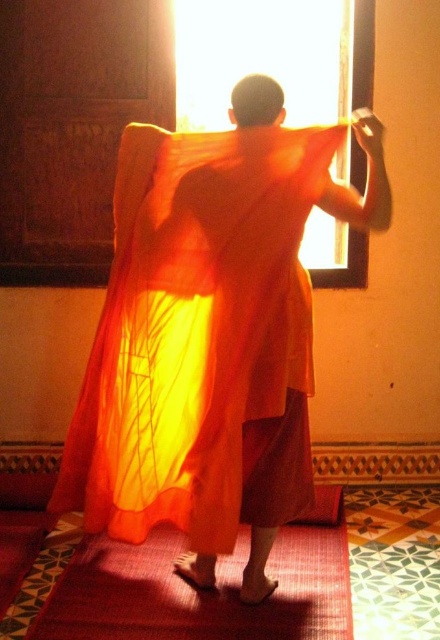
Based on the photo, can you confirm if translucent orange dress at center is positioned above matte red carpet at lower center?

Yes, translucent orange dress at center is above matte red carpet at lower center.

Measure the distance between translucent orange dress at center and camera.

7.50 feet

Where is `translucent orange dress at center`? translucent orange dress at center is located at coordinates (194, 326).